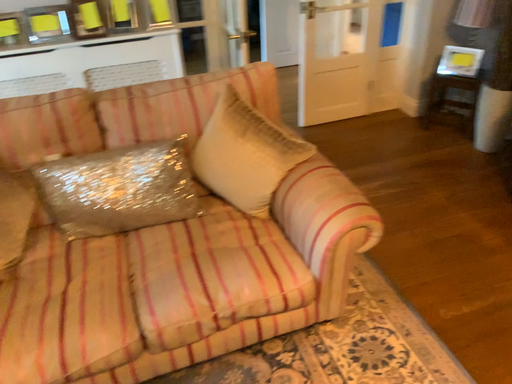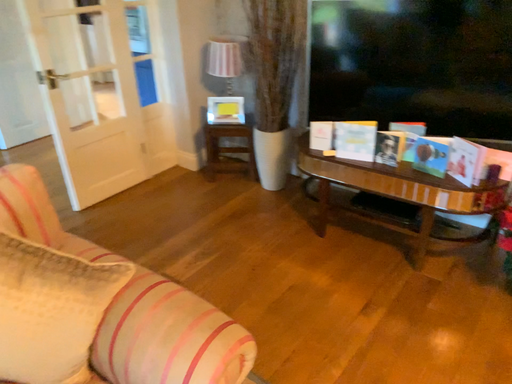
Question: Which way did the camera rotate in the video?

Choices:
 (A) rotated upward
 (B) rotated downward

Answer: (A)